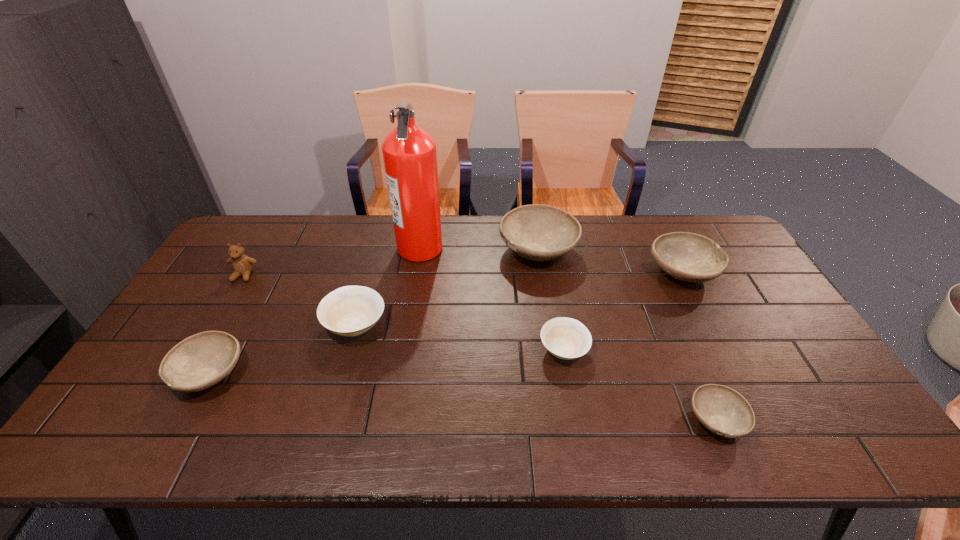
Locate an element on the screen. The image size is (960, 540). the smallest gray bowl is located at coordinates (722, 410).

Where is `blank area located 0.270m at the nozzle of the tallest object`? The image size is (960, 540). blank area located 0.270m at the nozzle of the tallest object is located at coordinates (521, 247).

Find the location of a particular element. blank space located on the front-facing side of the teddy bear is located at coordinates (200, 349).

The width and height of the screenshot is (960, 540). I want to click on free region located on the front of the tallest bowl, so click(551, 337).

In order to click on free space located on the right of the third smallest gray bowl in this screenshot , I will do `click(754, 272)`.

In order to click on vacant region located on the right of the fifth bowl from right to left in this screenshot , I will do `click(528, 325)`.

This screenshot has height=540, width=960. In order to click on vacant space located on the right of the leftmost bowl in this screenshot , I will do `click(327, 374)`.

You are a GUI agent. You are given a task and a screenshot of the screen. Output one action in this format:
    pyautogui.click(x=<x>, y=<y>)
    Task: Click on the free space located 0.090m on the right of the smaller beige bowl
    Image resolution: width=960 pixels, height=540 pixels.
    Given the screenshot: What is the action you would take?
    pyautogui.click(x=622, y=350)

The width and height of the screenshot is (960, 540). I want to click on vacant space located 0.300m on the back of the smallest gray bowl, so click(x=667, y=307).

Locate an element on the screen. fire extinguisher that is at the far edge is located at coordinates (409, 152).